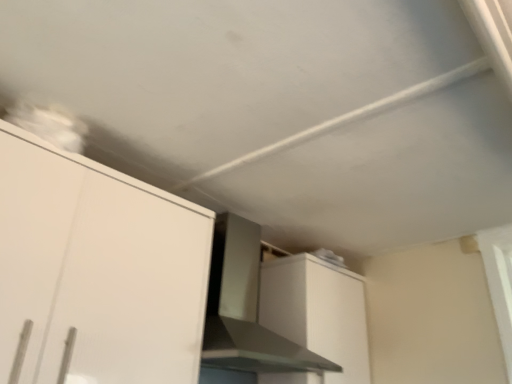
I want to click on satin silver vent at center, so click(x=246, y=308).

Measure the distance between white matte cabinet at upper left, the first cabinetry in the left-to-right sequence, and camera.

white matte cabinet at upper left, the first cabinetry in the left-to-right sequence, and camera are 3.32 feet apart from each other.

What is the approximate height of white matte cabinet at upper right, the 1th cabinetry from the back?

white matte cabinet at upper right, the 1th cabinetry from the back, is 23.00 inches tall.

This screenshot has width=512, height=384. Identify the location of satin silver vent at center. (246, 308).

Which of these two, white matte cabinet at upper right, the 1th cabinetry from the back, or white matte cabinet at upper left, which is counted as the 2th cabinetry, starting from the back, is smaller?

Smaller between the two is white matte cabinet at upper right, the 1th cabinetry from the back.

Is the depth of white matte cabinet at upper right, the 1th cabinetry from the back, greater than that of white matte cabinet at upper left, which is counted as the first cabinetry, starting from the front?

Yes, white matte cabinet at upper right, the 1th cabinetry from the back, is further from the viewer.

From the image's perspective, which is below, white matte cabinet at upper right, the first cabinetry positioned from the right, or white matte cabinet at upper left, which is counted as the first cabinetry, starting from the front?

white matte cabinet at upper right, the first cabinetry positioned from the right.

Considering the positions of points (142, 278) and (346, 341), is point (142, 278) farther from camera compared to point (346, 341)?

No, it is not.

Would you say white matte cabinet at upper left, which is counted as the second cabinetry, starting from the right, is inside or outside white matte cabinet at upper right, which appears as the second cabinetry when viewed from the left?

The correct answer is: outside.

Is white matte cabinet at upper left, the first cabinetry in the left-to-right sequence, directly adjacent to white matte cabinet at upper right, which appears as the second cabinetry when viewed from the left?

white matte cabinet at upper left, the first cabinetry in the left-to-right sequence, and white matte cabinet at upper right, which appears as the second cabinetry when viewed from the left, are not in contact.

Could you tell me if white matte cabinet at upper left, which is counted as the first cabinetry, starting from the front, is facing white matte cabinet at upper right, which appears as the second cabinetry when viewed from the left?

No, white matte cabinet at upper left, which is counted as the first cabinetry, starting from the front, is not oriented towards white matte cabinet at upper right, which appears as the second cabinetry when viewed from the left.

Does white matte cabinet at upper right, which appears as the second cabinetry when viewed from the left, have a lesser height compared to satin silver vent at center?

Yes.

From a real-world perspective, does white matte cabinet at upper right, the first cabinetry positioned from the right, stand above satin silver vent at center?

No, from a real-world perspective, white matte cabinet at upper right, the first cabinetry positioned from the right, is not above satin silver vent at center.

From the image's perspective, which object appears higher, white matte cabinet at upper right, the 1th cabinetry from the back, or satin silver vent at center?

satin silver vent at center is shown above in the image.

You are a GUI agent. You are given a task and a screenshot of the screen. Output one action in this format:
    pyautogui.click(x=<x>, y=<y>)
    Task: Click on the 1st cabinetry positioned below the satin silver vent at center (from a real-world perspective)
    
    Given the screenshot: What is the action you would take?
    pyautogui.click(x=318, y=312)

Based on their sizes in the image, would you say satin silver vent at center is bigger or smaller than white matte cabinet at upper right, the 1th cabinetry from the back?

Clearly, satin silver vent at center is larger in size than white matte cabinet at upper right, the 1th cabinetry from the back.

Locate an element on the screen. The width and height of the screenshot is (512, 384). vent above the white matte cabinet at upper right, which appears as the second cabinetry when viewed from the left (from a real-world perspective) is located at coordinates (246, 308).

Is satin silver vent at center oriented away from white matte cabinet at upper right, arranged as the 2th cabinetry when viewed from the front?

satin silver vent at center does not have its back to white matte cabinet at upper right, arranged as the 2th cabinetry when viewed from the front.

In the scene shown: Is satin silver vent at center thinner than white matte cabinet at upper right, the first cabinetry positioned from the right?

In fact, satin silver vent at center might be wider than white matte cabinet at upper right, the first cabinetry positioned from the right.

Who is smaller, satin silver vent at center or white matte cabinet at upper left, which is counted as the first cabinetry, starting from the front?

With smaller size is white matte cabinet at upper left, which is counted as the first cabinetry, starting from the front.

Is satin silver vent at center next to white matte cabinet at upper left, the first cabinetry in the left-to-right sequence, and touching it?

No, satin silver vent at center is not in contact with white matte cabinet at upper left, the first cabinetry in the left-to-right sequence.

Is the position of satin silver vent at center less distant than that of white matte cabinet at upper left, which is counted as the 2th cabinetry, starting from the back?

That is False.

Is satin silver vent at center not inside white matte cabinet at upper left, which is counted as the first cabinetry, starting from the front?

Yes.

Considering the sizes of objects white matte cabinet at upper left, which is counted as the first cabinetry, starting from the front, and satin silver vent at center in the image provided, who is bigger, white matte cabinet at upper left, which is counted as the first cabinetry, starting from the front, or satin silver vent at center?

Bigger between the two is satin silver vent at center.

Which is more to the right, white matte cabinet at upper left, which is counted as the 2th cabinetry, starting from the back, or satin silver vent at center?

satin silver vent at center.

How distant is white matte cabinet at upper left, which is counted as the 2th cabinetry, starting from the back, from satin silver vent at center?

white matte cabinet at upper left, which is counted as the 2th cabinetry, starting from the back, and satin silver vent at center are 16.81 inches apart from each other.

Which object is further away from the camera taking this photo, white matte cabinet at upper left, which is counted as the first cabinetry, starting from the front, or satin silver vent at center?

satin silver vent at center is behind.

Image resolution: width=512 pixels, height=384 pixels. Find the location of `cabinetry that is above the white matte cabinet at upper right, arranged as the 2th cabinetry when viewed from the front (from the image's perspective)`. cabinetry that is above the white matte cabinet at upper right, arranged as the 2th cabinetry when viewed from the front (from the image's perspective) is located at coordinates (97, 269).

You are a GUI agent. You are given a task and a screenshot of the screen. Output one action in this format:
    pyautogui.click(x=<x>, y=<y>)
    Task: Click on the cabinetry behind the white matte cabinet at upper left, which is counted as the second cabinetry, starting from the right
    Image resolution: width=512 pixels, height=384 pixels.
    Given the screenshot: What is the action you would take?
    pyautogui.click(x=318, y=312)

From the image, which object appears to be nearer to white matte cabinet at upper right, which appears as the second cabinetry when viewed from the left, white matte cabinet at upper left, which is counted as the first cabinetry, starting from the front, or satin silver vent at center?

satin silver vent at center.

Based on their spatial positions, is white matte cabinet at upper left, the first cabinetry in the left-to-right sequence, or white matte cabinet at upper right, which appears as the second cabinetry when viewed from the left, closer to satin silver vent at center?

white matte cabinet at upper right, which appears as the second cabinetry when viewed from the left.

Which object lies further to the anchor point white matte cabinet at upper right, which appears as the second cabinetry when viewed from the left, satin silver vent at center or white matte cabinet at upper left, which is counted as the second cabinetry, starting from the right?

white matte cabinet at upper left, which is counted as the second cabinetry, starting from the right.

Based on their spatial positions, is satin silver vent at center or white matte cabinet at upper right, the first cabinetry positioned from the right, closer to white matte cabinet at upper left, which is counted as the 2th cabinetry, starting from the back?

satin silver vent at center.

When comparing their distances from satin silver vent at center, does white matte cabinet at upper right, the first cabinetry positioned from the right, or white matte cabinet at upper left, the first cabinetry in the left-to-right sequence, seem closer?

white matte cabinet at upper right, the first cabinetry positioned from the right, is closer to satin silver vent at center.

From the image, which object appears to be nearer to white matte cabinet at upper left, which is counted as the second cabinetry, starting from the right, white matte cabinet at upper right, which appears as the second cabinetry when viewed from the left, or satin silver vent at center?

satin silver vent at center.

In order to click on vent between white matte cabinet at upper left, which is counted as the 2th cabinetry, starting from the back, and white matte cabinet at upper right, the first cabinetry positioned from the right, along the z-axis in this screenshot , I will do `click(246, 308)`.